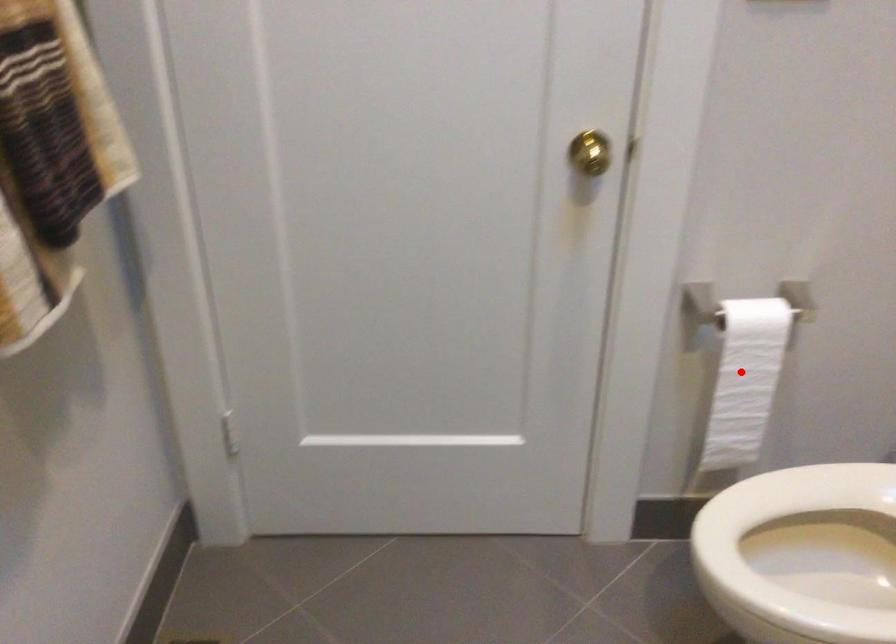
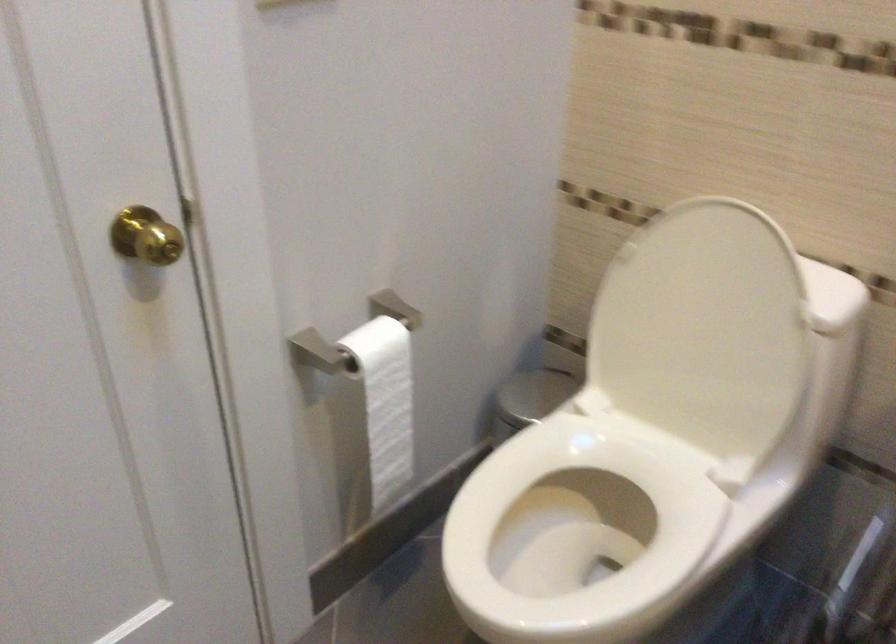
Question: I am providing you with two images of the same scene from different viewpoints. Given a red point in image1, look at the same physical point in image2. Is it:

Choices:
 (A) Closer to the viewpoint
 (B) Farther from the viewpoint

Answer: (A)